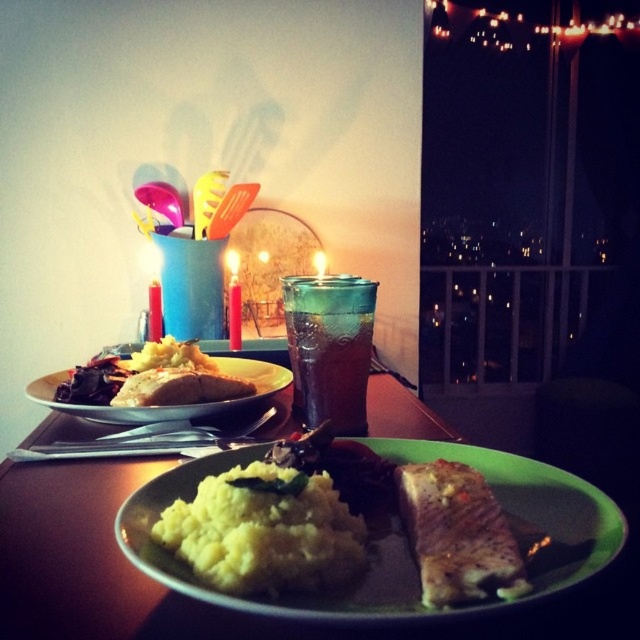
Which of these two, golden mashed potatoes at left or white matte plate at center, stands taller?

With more height is golden mashed potatoes at left.

Which is above, golden mashed potatoes at left or white matte plate at center?

golden mashed potatoes at left is higher up.

This screenshot has width=640, height=640. Identify the location of golden mashed potatoes at left. (152, 378).

This screenshot has width=640, height=640. I want to click on golden mashed potatoes at left, so click(152, 378).

Does yellow mashed potato at center appear on the left side of translucent glass at center?

Yes, yellow mashed potato at center is to the left of translucent glass at center.

Does point (269, 556) come closer to viewer compared to point (369, 316)?

That is True.

Between point (269, 464) and point (304, 353), which one is positioned in front?

Positioned in front is point (269, 464).

This screenshot has height=640, width=640. I want to click on yellow mashed potato at center, so click(266, 531).

Can you confirm if yellow mashed potatoes at center is taller than white matte plate at center?

No.

Does yellow mashed potatoes at center appear on the left side of white matte plate at center?

In fact, yellow mashed potatoes at center is to the right of white matte plate at center.

Identify the location of yellow mashed potatoes at center. (342, 524).

At what (x,y) coordinates should I click in order to perform the action: click on yellow mashed potatoes at center. Please return your answer as a coordinate pair (x, y). This screenshot has width=640, height=640. Looking at the image, I should click on (342, 524).